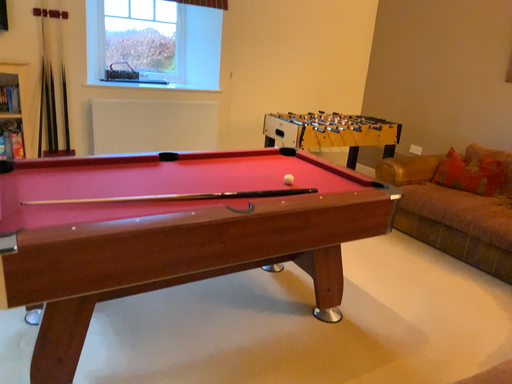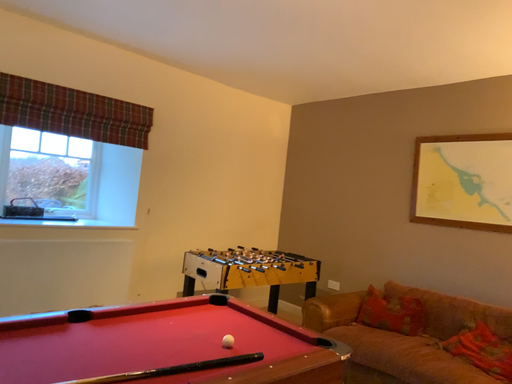
Question: Which way did the camera rotate in the video?

Choices:
 (A) rotated right
 (B) rotated left

Answer: (A)